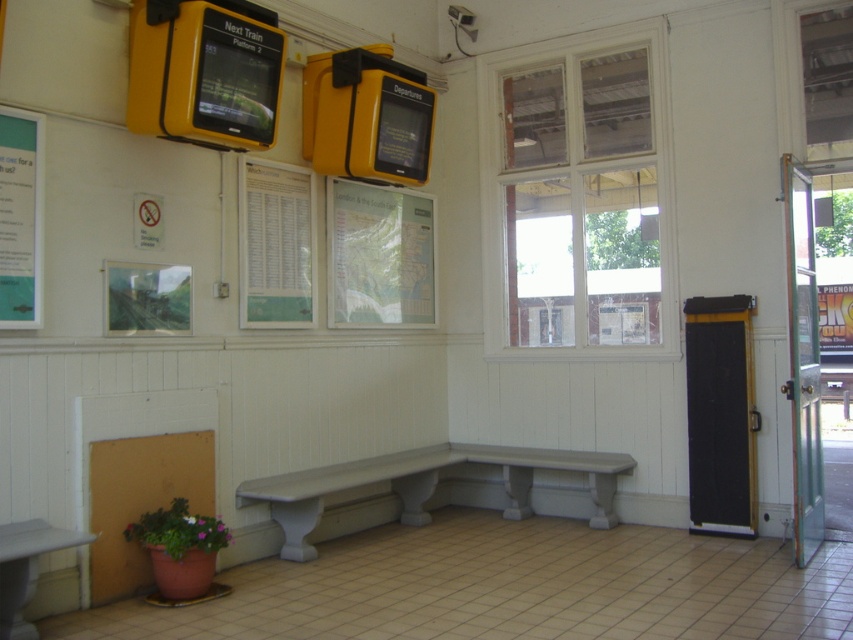
You are a passenger sitting on the smooth gray bench at center and want to read the teal glossy poster at left. Can you see it clearly without moving from your seat?

The teal glossy poster at left is in front of the smooth gray bench at center, so yes, you can see it clearly from your seat without needing to move.

You are standing at the point marked as point (426, 484) in the train station waiting area. What object are you standing on?

The point (426, 484) is on white painted wood bench at center, so you are standing on the white painted wood bench at center.

You are a traveler who needs to check both the green paper at center and the teal glossy poster at left for information. Which one do you think you can read more details on due to its size?

The green paper at center has a larger width than the teal glossy poster at left, so you can read more details on the green paper at center.